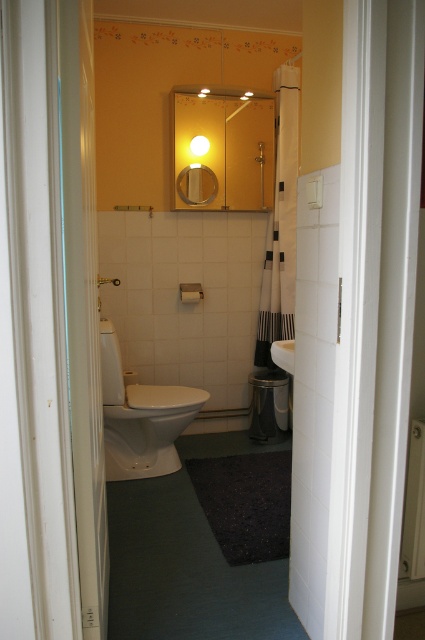
Who is lower down, white glossy sink at center or white glossy lamp at upper center?

Positioned lower is white glossy sink at center.

Is white glossy sink at center positioned in front of white glossy lamp at upper center?

Yes, white glossy sink at center is in front of white glossy lamp at upper center.

Which is in front, point (274, 349) or point (206, 145)?

Point (274, 349) is more forward.

Find the location of `white glossy sink at center`. white glossy sink at center is located at coordinates (283, 355).

Can you confirm if white glossy sink at center is positioned below matte white shower at center?

Yes.

Which is in front, point (271, 349) or point (118, 284)?

Positioned in front is point (271, 349).

Describe the element at coordinates (283, 355) in the screenshot. I see `white glossy sink at center` at that location.

I want to click on white glossy sink at center, so [283, 355].

Does white glossy toilet at center come in front of white glossy sink at center?

That is False.

How distant is white glossy toilet at center from white glossy sink at center?

The distance of white glossy toilet at center from white glossy sink at center is 76.85 centimeters.

Locate an element on the screen. white glossy toilet at center is located at coordinates (141, 417).